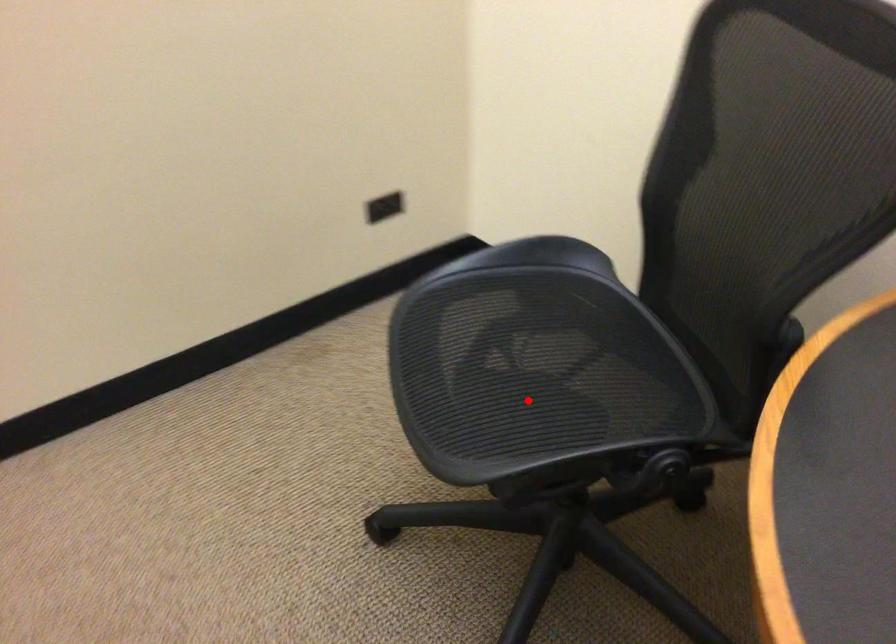
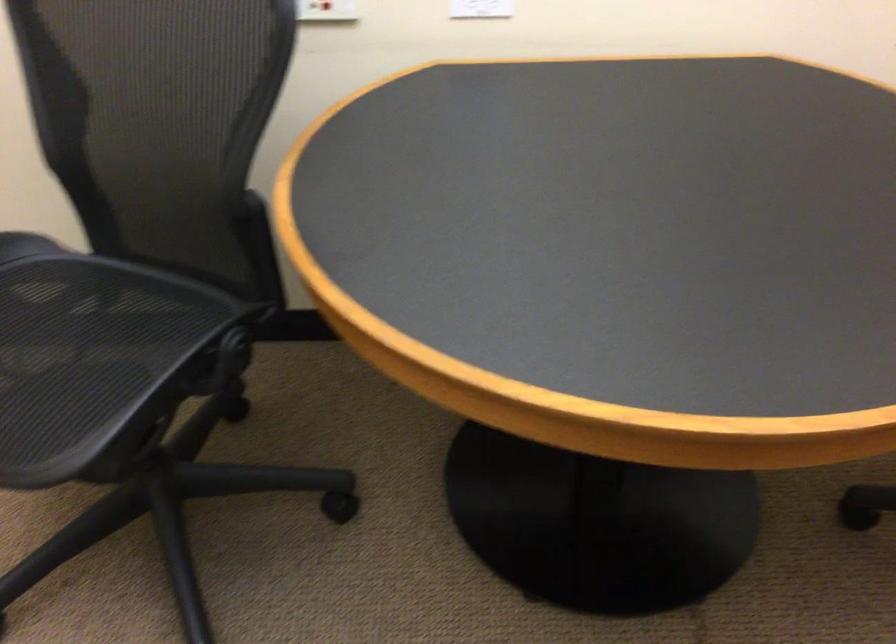
The point at the highlighted location is marked in the first image. Where is the corresponding point in the second image?

(75, 373)